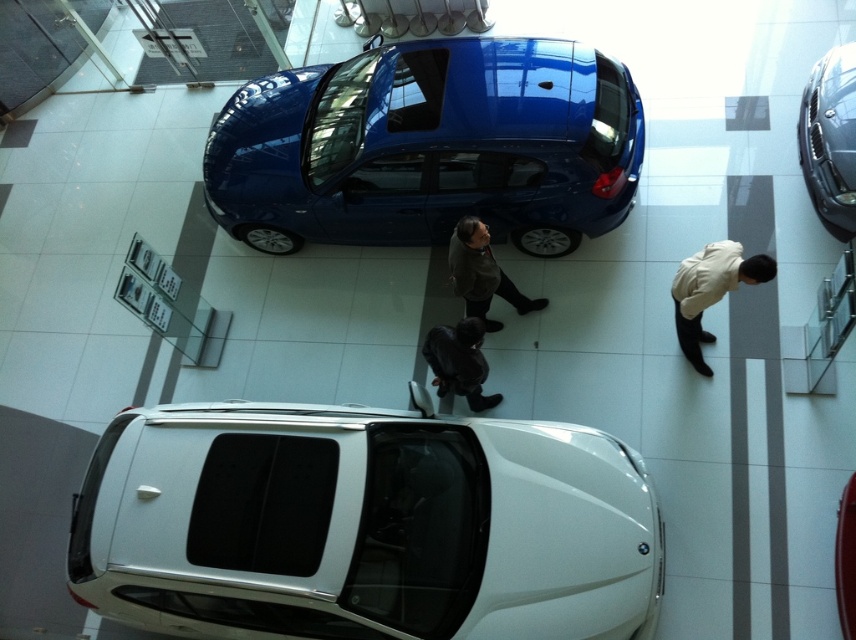
Question: Which object is closer to the camera taking this photo?

Choices:
 (A) dark green sweater at center
 (B) white glossy suv at lower center
 (C) glossy black car at upper right

Answer: (B)

Question: Does glossy black car at upper right appear on the left side of black leather jacket at center?

Choices:
 (A) yes
 (B) no

Answer: (B)

Question: Which point is farther to the camera?

Choices:
 (A) (821, 140)
 (B) (694, 339)
 (C) (477, 410)

Answer: (C)

Question: Which object is the farthest from the glossy blue hatchback at center?

Choices:
 (A) glossy black car at upper right
 (B) white matte jacket at lower right
 (C) dark green sweater at center
 (D) white glossy suv at lower center

Answer: (A)

Question: Is white glossy suv at lower center wider than glossy blue hatchback at center?

Choices:
 (A) yes
 (B) no

Answer: (A)

Question: Is white glossy suv at lower center above black leather jacket at center?

Choices:
 (A) no
 (B) yes

Answer: (A)